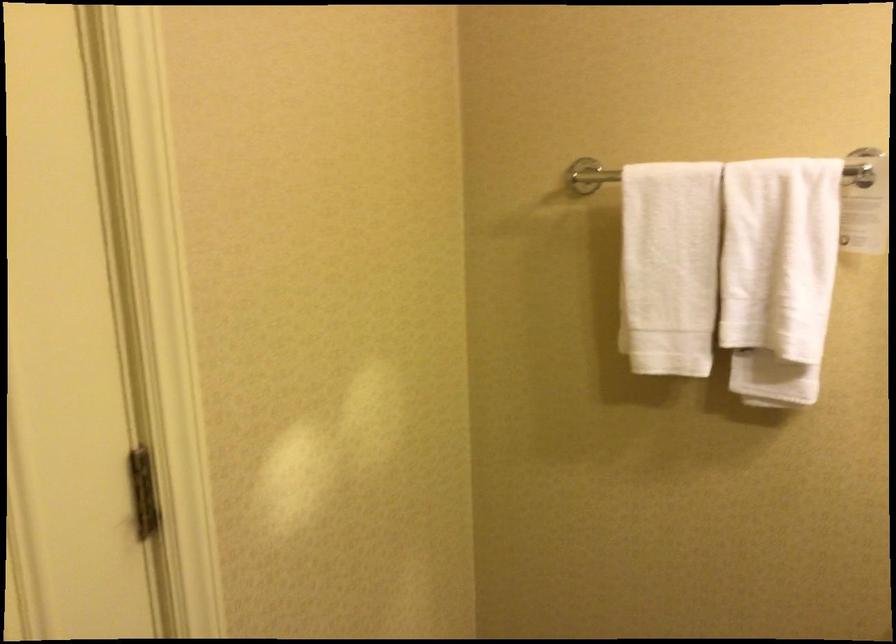
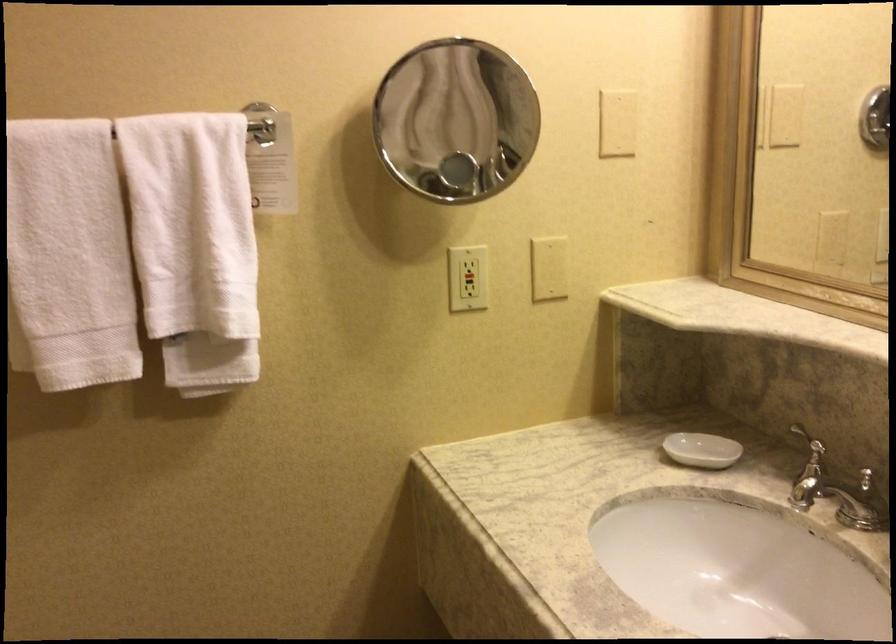
Question: I am providing you with two images of the same scene from different viewpoints. Please identify which objects are invisible in image2.

Choices:
 (A) black outlet button
 (B) white soap dish
 (C) red outlet button
 (D) none of these

Answer: (D)